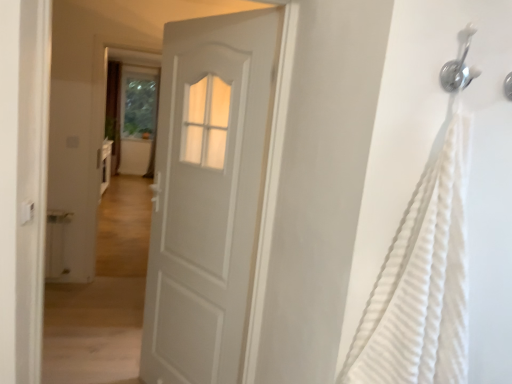
Question: Is transparent glass screen door at upper center oriented towards silver metallic shower head at upper right?

Choices:
 (A) no
 (B) yes

Answer: (A)

Question: Is the position of transparent glass screen door at upper center more distant than that of silver metallic shower head at upper right?

Choices:
 (A) no
 (B) yes

Answer: (B)

Question: Is transparent glass screen door at upper center to the right of silver metallic shower head at upper right from the viewer's perspective?

Choices:
 (A) yes
 (B) no

Answer: (B)

Question: From a real-world perspective, is transparent glass screen door at upper center positioned under silver metallic shower head at upper right based on gravity?

Choices:
 (A) yes
 (B) no

Answer: (A)

Question: Does transparent glass screen door at upper center appear on the left side of silver metallic shower head at upper right?

Choices:
 (A) no
 (B) yes

Answer: (B)

Question: From the image's perspective, relative to transparent glass screen door at upper center, is white matte door at center above or below?

Choices:
 (A) below
 (B) above

Answer: (A)

Question: Is white matte door at center spatially inside transparent glass screen door at upper center, or outside of it?

Choices:
 (A) outside
 (B) inside

Answer: (A)

Question: Considering the positions of point (192, 352) and point (121, 115), is point (192, 352) closer or farther from the camera than point (121, 115)?

Choices:
 (A) closer
 (B) farther

Answer: (A)

Question: From their relative heights in the image, would you say white matte door at center is taller or shorter than transparent glass screen door at upper center?

Choices:
 (A) tall
 (B) short

Answer: (B)

Question: Is white textured fabric at right inside the boundaries of silver metallic shower head at upper right, or outside?

Choices:
 (A) inside
 (B) outside

Answer: (B)

Question: From the image's perspective, is white textured fabric at right above or below silver metallic shower head at upper right?

Choices:
 (A) below
 (B) above

Answer: (A)

Question: From a real-world perspective, relative to silver metallic shower head at upper right, is white textured fabric at right vertically above or below?

Choices:
 (A) above
 (B) below

Answer: (B)

Question: Considering the relative positions of white textured fabric at right and silver metallic shower head at upper right in the image provided, is white textured fabric at right to the left or to the right of silver metallic shower head at upper right?

Choices:
 (A) right
 (B) left

Answer: (B)

Question: Is transparent glass screen door at upper center inside or outside of white matte door at center?

Choices:
 (A) outside
 (B) inside

Answer: (A)

Question: From their relative heights in the image, would you say transparent glass screen door at upper center is taller or shorter than white matte door at center?

Choices:
 (A) short
 (B) tall

Answer: (B)